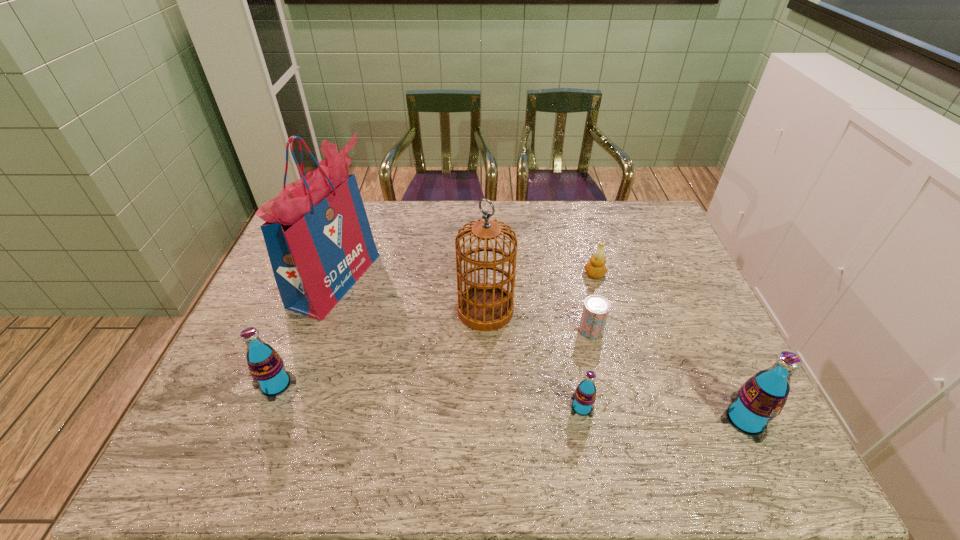
Image resolution: width=960 pixels, height=540 pixels. What are the coordinates of `the fourth shortest object` in the screenshot? It's located at (266, 367).

You are a GUI agent. You are given a task and a screenshot of the screen. Output one action in this format:
    pyautogui.click(x=<x>, y=<y>)
    Task: Click on the second tallest soda
    This screenshot has width=960, height=540.
    Given the screenshot: What is the action you would take?
    pyautogui.click(x=266, y=367)

Image resolution: width=960 pixels, height=540 pixels. What are the coordinates of `the shortest soda` in the screenshot? It's located at (584, 397).

Where is `the fourth object from left to right`? This screenshot has height=540, width=960. the fourth object from left to right is located at coordinates pyautogui.click(x=584, y=397).

In order to click on the rightmost soda in this screenshot , I will do `click(761, 398)`.

At what (x,y) coordinates should I click in order to perform the action: click on the tallest object. Please return your answer as a coordinate pair (x, y). The width and height of the screenshot is (960, 540). Looking at the image, I should click on (317, 234).

Identify the location of candle_holder. The height and width of the screenshot is (540, 960). (595, 268).

Locate an element on the screen. birdcage is located at coordinates (484, 306).

Where is `the fifth object from right to left`? This screenshot has height=540, width=960. the fifth object from right to left is located at coordinates (484, 306).

This screenshot has width=960, height=540. I want to click on the shortest object, so click(x=596, y=308).